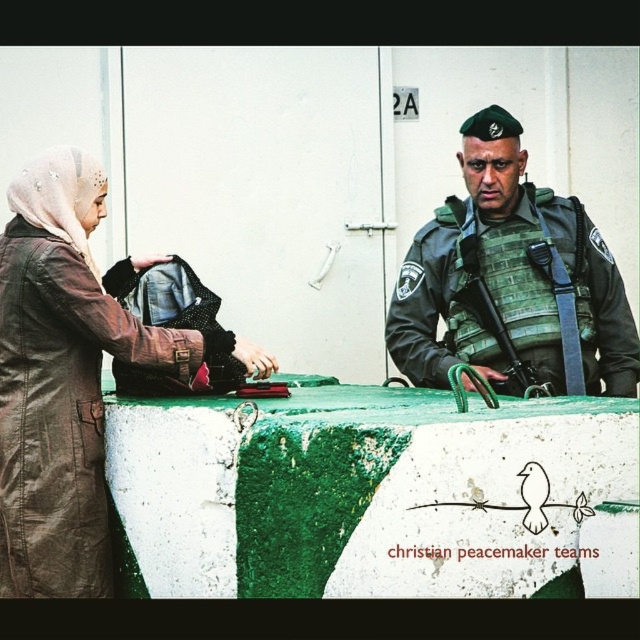
You are a drone operator observing the checkpoint scene. You need to determine if the green military uniform at right is positioned higher than the green textured rifle at center. Can you confirm this based on your vantage point?

The green military uniform at right is above the green textured rifle at center, so yes, the green military uniform at right is positioned higher than the green textured rifle at center from your vantage point.